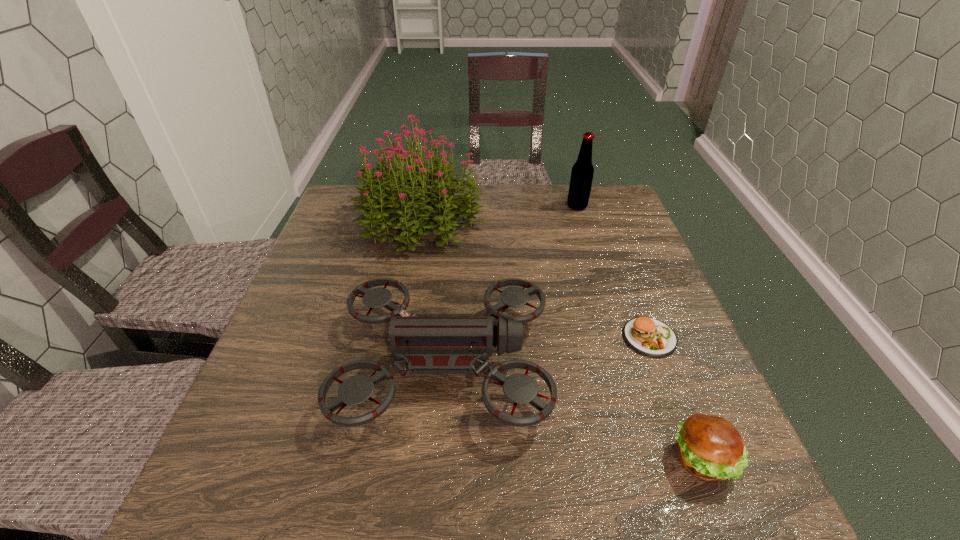
I want to click on bouquet, so click(412, 190).

Locate an element on the screen. the second tallest object is located at coordinates (582, 172).

You are a GUI agent. You are given a task and a screenshot of the screen. Output one action in this format:
    pyautogui.click(x=<x>, y=<y>)
    Task: Click on the third tallest object
    The width and height of the screenshot is (960, 540).
    Given the screenshot: What is the action you would take?
    pyautogui.click(x=427, y=343)

Locate an element on the screen. hamburger is located at coordinates (710, 448).

Identify the location of the shortest object. (651, 337).

Where is `vacant space situated 0.060m on the front of the bouquet`? The image size is (960, 540). vacant space situated 0.060m on the front of the bouquet is located at coordinates (412, 275).

Where is `free spot located on the back of the beer bottle`? free spot located on the back of the beer bottle is located at coordinates (570, 185).

Locate an element on the screen. The image size is (960, 540). vacant space positioned on the front-facing side of the drone is located at coordinates (617, 363).

The width and height of the screenshot is (960, 540). In order to click on vacant region located on the left of the second shortest object in this screenshot , I will do `click(499, 460)`.

What are the coordinates of `free space located on the left of the patty` in the screenshot? It's located at (572, 338).